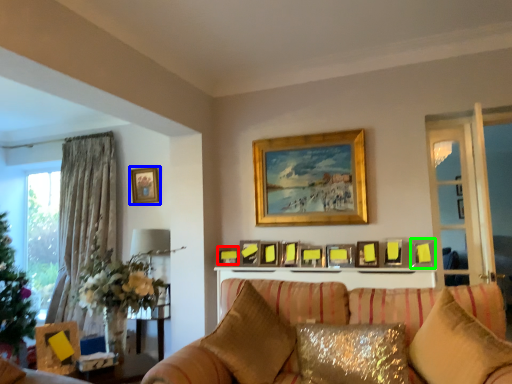
Question: Based on their relative distances, which object is nearer to picture frame (highlighted by a red box)? Choose from picture frame (highlighted by a blue box) and picture frame (highlighted by a green box).

Choices:
 (A) picture frame
 (B) picture frame

Answer: (A)